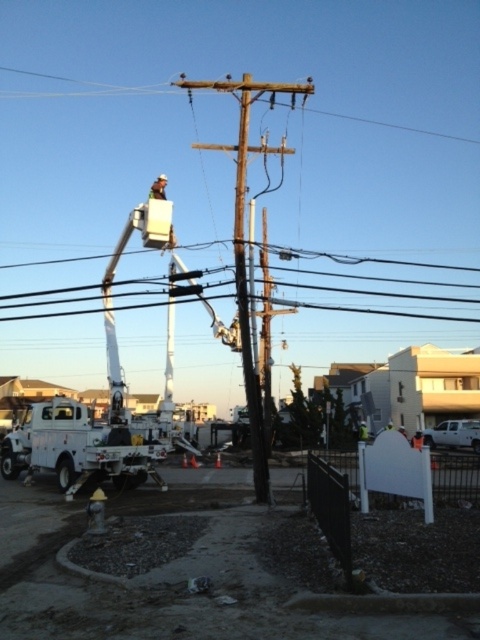
Question: Estimate the real-world distances between objects in this image. Which object is farther from the light brown leather helmet at upper center?

Choices:
 (A) white plastic fire hydrant at lower left
 (B) black wire at upper center

Answer: (B)

Question: Which object is farther from the camera taking this photo?

Choices:
 (A) light brown leather helmet at upper center
 (B) black wire at upper center

Answer: (A)

Question: Based on their relative distances, which object is farther from the brown wooden telegraph pole at center?

Choices:
 (A) black wire at upper center
 (B) white plastic fire hydrant at lower left
 (C) light brown leather helmet at upper center

Answer: (A)

Question: Does brown wooden telegraph pole at center appear on the left side of light brown leather helmet at upper center?

Choices:
 (A) yes
 (B) no

Answer: (B)

Question: From the image, what is the correct spatial relationship of white plastic fire hydrant at lower left in relation to light brown leather helmet at upper center?

Choices:
 (A) right
 (B) left

Answer: (A)

Question: Can you confirm if brown wooden telegraph pole at center is positioned above light brown leather helmet at upper center?

Choices:
 (A) yes
 (B) no

Answer: (A)